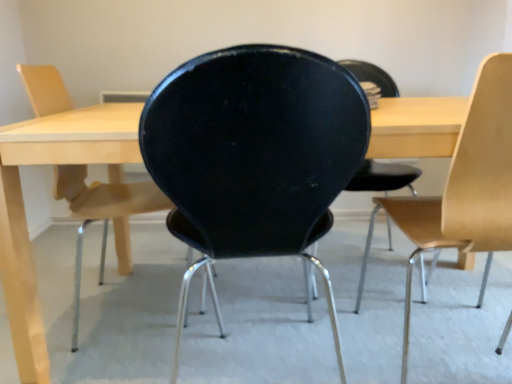
Question: From a real-world perspective, is matte black chair at center, which appears as the 1th chair when viewed from the left, positioned under black matte chair at center, the second chair in the right-to-left sequence, based on gravity?

Choices:
 (A) no
 (B) yes

Answer: (B)

Question: Can we say matte black chair at center, marked as the third chair in a right-to-left arrangement, lies outside black matte chair at center, the second chair in the right-to-left sequence?

Choices:
 (A) no
 (B) yes

Answer: (B)

Question: Can you confirm if matte black chair at center, marked as the third chair in a right-to-left arrangement, is taller than black matte chair at center, the second chair in the right-to-left sequence?

Choices:
 (A) no
 (B) yes

Answer: (B)

Question: Is matte black chair at center, which appears as the 1th chair when viewed from the left, at the left side of black matte chair at center, the second chair in the right-to-left sequence?

Choices:
 (A) yes
 (B) no

Answer: (A)

Question: Does matte black chair at center, which appears as the 1th chair when viewed from the left, have a greater width compared to black matte chair at center, the second chair in the right-to-left sequence?

Choices:
 (A) no
 (B) yes

Answer: (A)

Question: Can you confirm if matte black chair at center, which appears as the 1th chair when viewed from the left, is positioned to the right of black matte chair at center, the second chair in the right-to-left sequence?

Choices:
 (A) yes
 (B) no

Answer: (B)

Question: Could light wood/wooden chair at right, the 3th chair from the left, be considered to be inside black matte chair at center, which ranks as the second chair in left-to-right order?

Choices:
 (A) no
 (B) yes

Answer: (A)

Question: Considering the relative sizes of black matte chair at center, the second chair in the right-to-left sequence, and light wood/wooden chair at right, the first chair from the right, in the image provided, is black matte chair at center, the second chair in the right-to-left sequence, wider than light wood/wooden chair at right, the first chair from the right,?

Choices:
 (A) yes
 (B) no

Answer: (B)

Question: Considering the relative sizes of black matte chair at center, which ranks as the second chair in left-to-right order, and light wood/wooden chair at right, the first chair from the right, in the image provided, is black matte chair at center, which ranks as the second chair in left-to-right order, taller than light wood/wooden chair at right, the first chair from the right,?

Choices:
 (A) no
 (B) yes

Answer: (A)

Question: Does black matte chair at center, the second chair in the right-to-left sequence, come behind light wood/wooden chair at right, the first chair from the right?

Choices:
 (A) yes
 (B) no

Answer: (B)

Question: Can you confirm if black matte chair at center, the second chair in the right-to-left sequence, is bigger than light wood/wooden chair at right, the first chair from the right?

Choices:
 (A) yes
 (B) no

Answer: (B)

Question: Is black matte chair at center, the second chair in the right-to-left sequence, thinner than light wood/wooden chair at right, the 3th chair from the left?

Choices:
 (A) no
 (B) yes

Answer: (B)

Question: Is matte black chair at center, which appears as the 1th chair when viewed from the left, in contact with light wood/wooden chair at right, the 3th chair from the left?

Choices:
 (A) yes
 (B) no

Answer: (B)